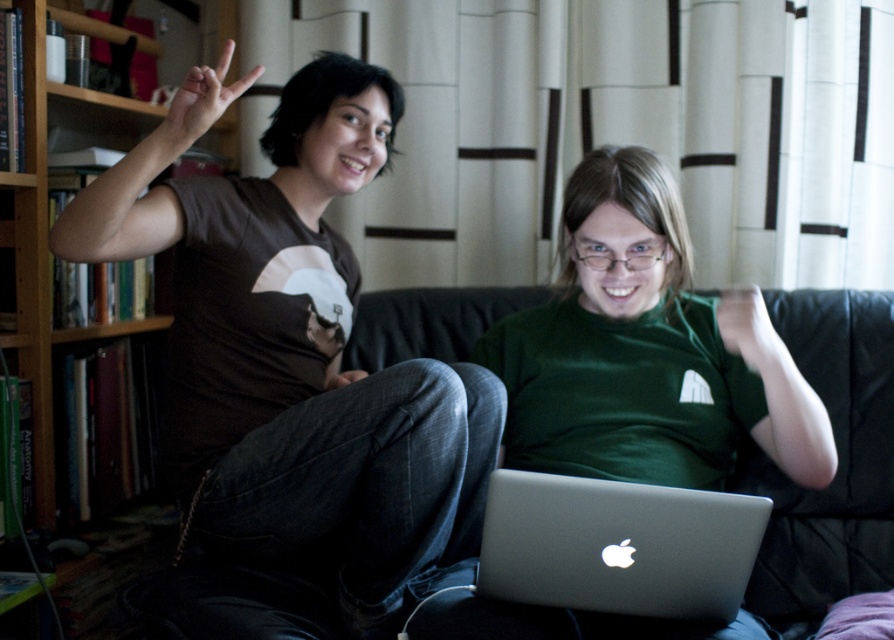
Can you confirm if silver metallic laptop at center is bigger than matte black hand at upper left?

Yes, silver metallic laptop at center is bigger than matte black hand at upper left.

Which is in front, point (568, 600) or point (222, 113)?

Point (568, 600) is in front.

Is point (626, 600) positioned before point (246, 80)?

Yes, it is in front of point (246, 80).

Locate an element on the screen. This screenshot has width=894, height=640. silver metallic laptop at center is located at coordinates (618, 545).

Locate an element on the screen. The image size is (894, 640). matte green t-shirt at center is located at coordinates (646, 352).

Is point (757, 364) positioned in front of point (222, 109)?

That is False.

You are a GUI agent. You are given a task and a screenshot of the screen. Output one action in this format:
    pyautogui.click(x=<x>, y=<y>)
    Task: Click on the matte green t-shirt at center
    
    Given the screenshot: What is the action you would take?
    pyautogui.click(x=646, y=352)

Between silver metallic laptop at center and wooden bookshelf at left, which one has less height?

silver metallic laptop at center is shorter.

Between point (704, 572) and point (70, 100), which one is positioned in front?

Positioned in front is point (704, 572).

The width and height of the screenshot is (894, 640). What are the coordinates of `silver metallic laptop at center` in the screenshot? It's located at (618, 545).